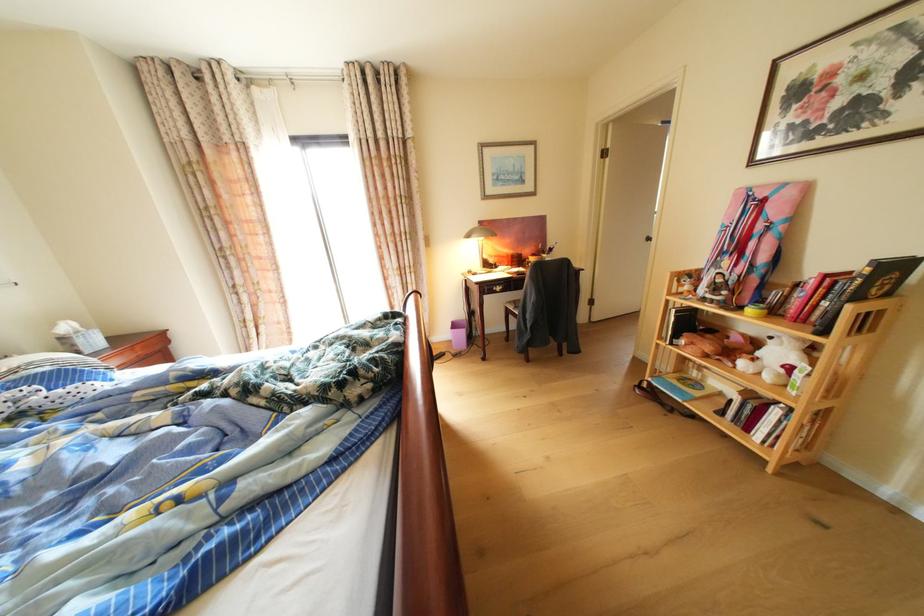
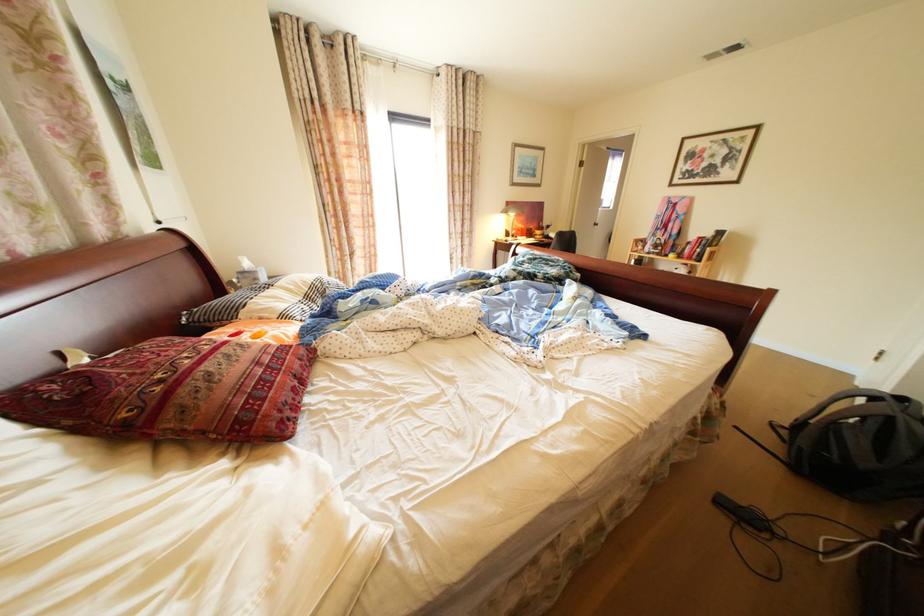
Find the pixel in the second image that matches point (477, 237) in the first image.

(514, 213)